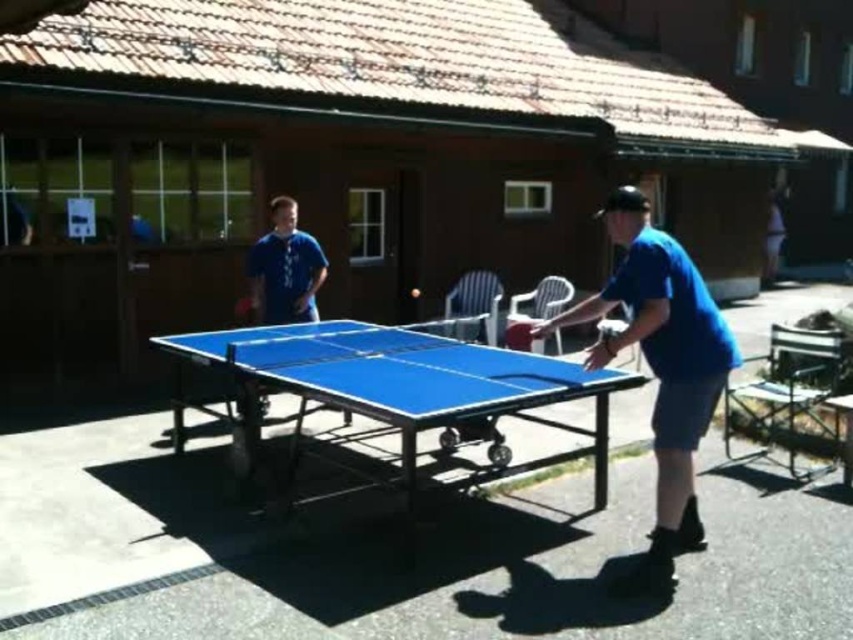
You are a photographer trying to capture a wide shot of the blue plastic table at center and the blue matte shirt at center. Do you think you can fit both into your camera frame if the maximum width your camera can capture is 2 meters?

The blue plastic table at center might be wider than blue matte shirt at center, so it is uncertain whether both will fit into the 2 meter frame. Check the actual width of the table first.

You are standing 5 feet away from the blue plastic table at center. If you take two steps forward, each step covering 2.5 feet, will you be able to reach the table?

The blue plastic table at center is 10.51 feet away from the viewer. After taking two steps forward, each covering 2.5 feet, you would have moved 5 feet closer, totaling 10 feet. Since 10 feet is less than 10.51 feet, you would still be 0.51 feet away from the table and unable to reach it.